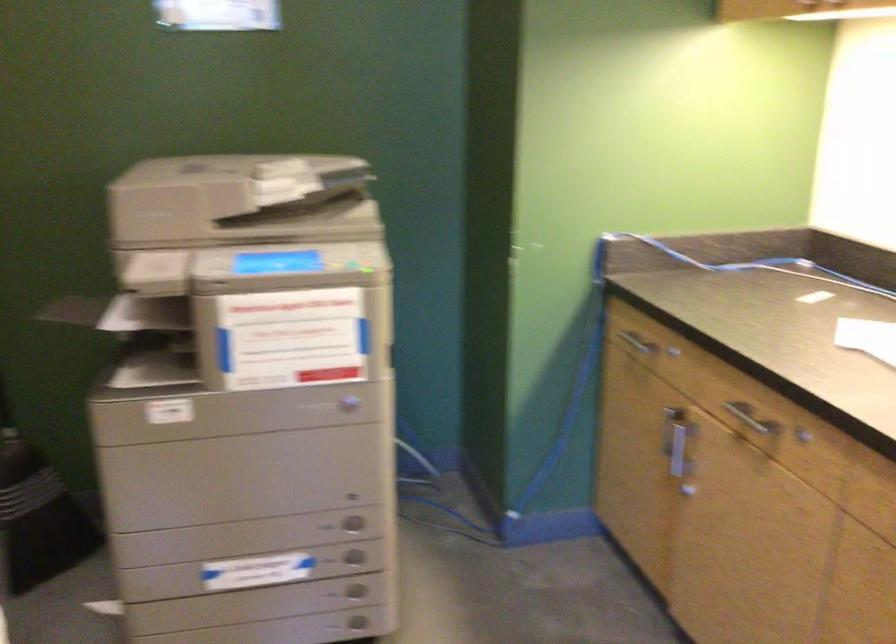
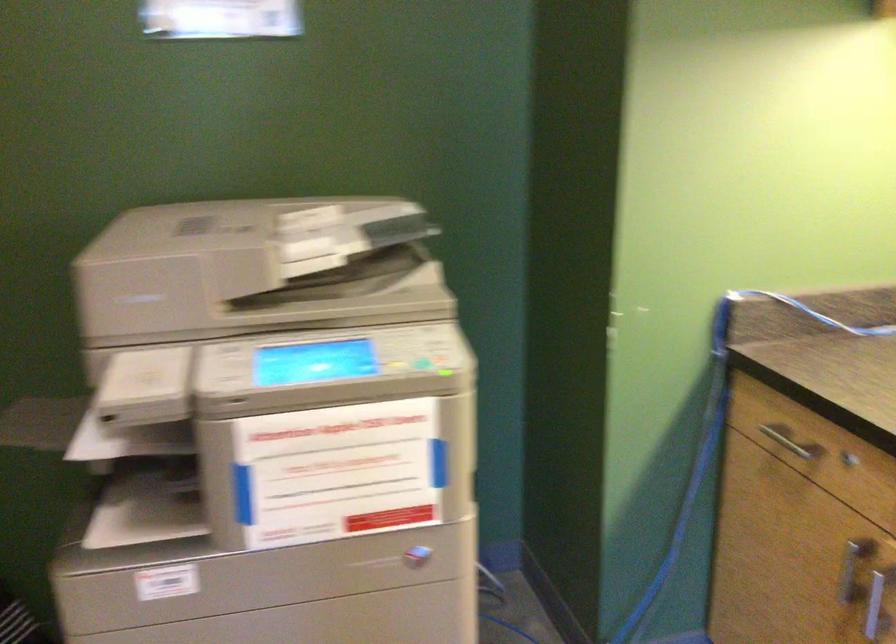
Question: What movement of the cameraman would produce the second image?

Choices:
 (A) Left
 (B) Right
 (C) Forward
 (D) Backward

Answer: (C)